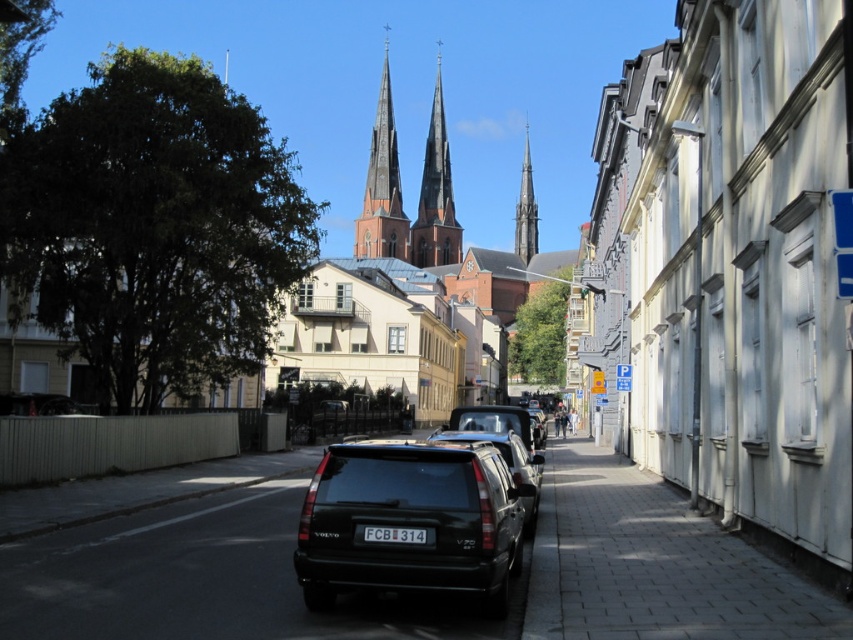
You are a tour guide leading a group of visitors to the historic church spire. You see the smooth stone spire at center and the black plastic license plate at center. Which one is farther away from your current position?

The smooth stone spire at center is farther away from your current position than the black plastic license plate at center because it is 727.74 feet away from the black plastic license plate at center.

You are a tourist in a European town and see a black plastic license plate at center and a blue plastic parking sign at center. Which object is shorter in height?

The black plastic license plate at center is shorter in height compared to the blue plastic parking sign at center.

You are a tourist standing on the street and want to compare the widths of the smooth stone spire at center and the black plastic license plate at center. Which one is wider?

The smooth stone spire at center is wider than the black plastic license plate at center.